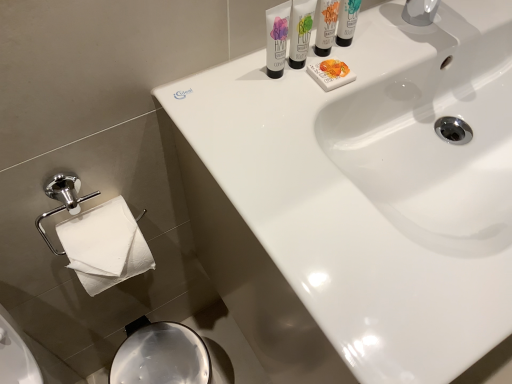
Question: Based on their sizes in the image, would you say matte white shaving cream at upper center, the 2th shaving cream viewed from the left, is bigger or smaller than white glossy sink at upper center?

Choices:
 (A) big
 (B) small

Answer: (B)

Question: Based on their positions, is matte white shaving cream at upper center, the second shaving cream in the right-to-left sequence, located to the left or right of white glossy sink at upper center?

Choices:
 (A) left
 (B) right

Answer: (A)

Question: Based on their relative distances, which object is nearer to the white glossy tube at upper center, arranged as the third shaving cream when viewed from the right?

Choices:
 (A) matte white shaving cream at upper right, which is the 1th shaving cream in right-to-left order
 (B) white matte soap at upper center
 (C) matte white shaving cream at upper center, the 2th shaving cream viewed from the left
 (D) white glossy sink at upper center

Answer: (C)

Question: Estimate the real-world distances between objects in this image. Which object is farther from the white matte soap at upper center?

Choices:
 (A) matte white shaving cream at upper right, the 3th shaving cream from the left
 (B) white glossy tube at upper center, arranged as the 1th shaving cream when viewed from the left
 (C) matte white shaving cream at upper center, the second shaving cream in the right-to-left sequence
 (D) white glossy sink at upper center

Answer: (D)